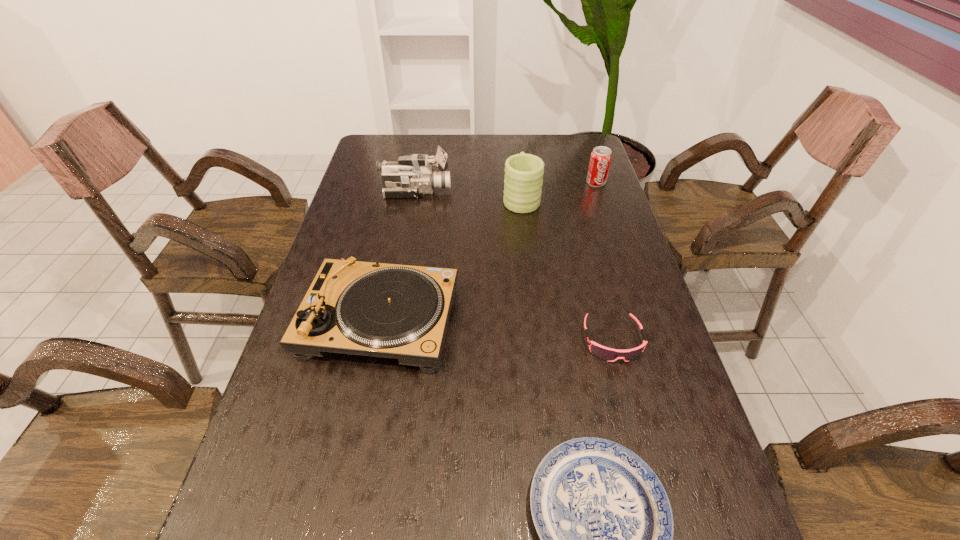
Find the location of `free spot between the mug and the goggles`. free spot between the mug and the goggles is located at coordinates (566, 268).

I want to click on vacant space that is in between the record player and the soda can, so click(488, 252).

You are a GUI agent. You are given a task and a screenshot of the screen. Output one action in this format:
    pyautogui.click(x=<x>, y=<y>)
    Task: Click on the unoccupied area between the record player and the camcorder
    Image resolution: width=960 pixels, height=540 pixels.
    Given the screenshot: What is the action you would take?
    pyautogui.click(x=398, y=256)

I want to click on vacant region between the goggles and the camcorder, so click(x=514, y=265).

This screenshot has width=960, height=540. I want to click on free point between the soda can and the goggles, so click(604, 261).

Where is `free space between the soda can and the mug`? The height and width of the screenshot is (540, 960). free space between the soda can and the mug is located at coordinates (559, 190).

You are a GUI agent. You are given a task and a screenshot of the screen. Output one action in this format:
    pyautogui.click(x=<x>, y=<y>)
    Task: Click on the free area in between the record player and the camcorder
    Image resolution: width=960 pixels, height=540 pixels.
    Given the screenshot: What is the action you would take?
    (x=398, y=256)

Image resolution: width=960 pixels, height=540 pixels. I want to click on empty space that is in between the record player and the fifth tallest object, so tap(496, 330).

Where is `object that stands as the fourth closest to the camcorder`? The height and width of the screenshot is (540, 960). object that stands as the fourth closest to the camcorder is located at coordinates (608, 354).

Select which object is the fourth closest to the goggles. Please provide its 2D coordinates. Your answer should be formatted as a tuple, i.e. [(x, y)], where the tuple contains the x and y coordinates of a point satisfying the conditions above.

[(601, 156)]